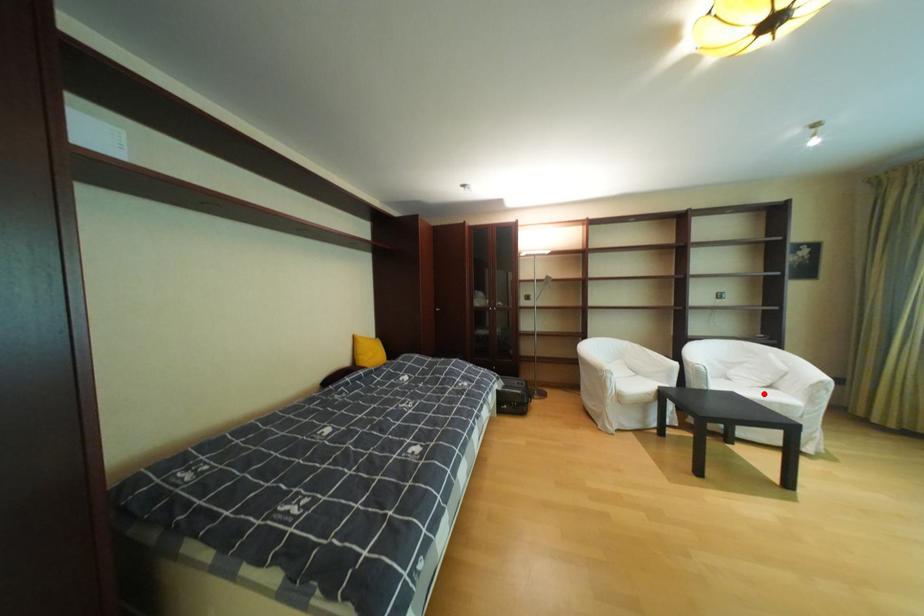
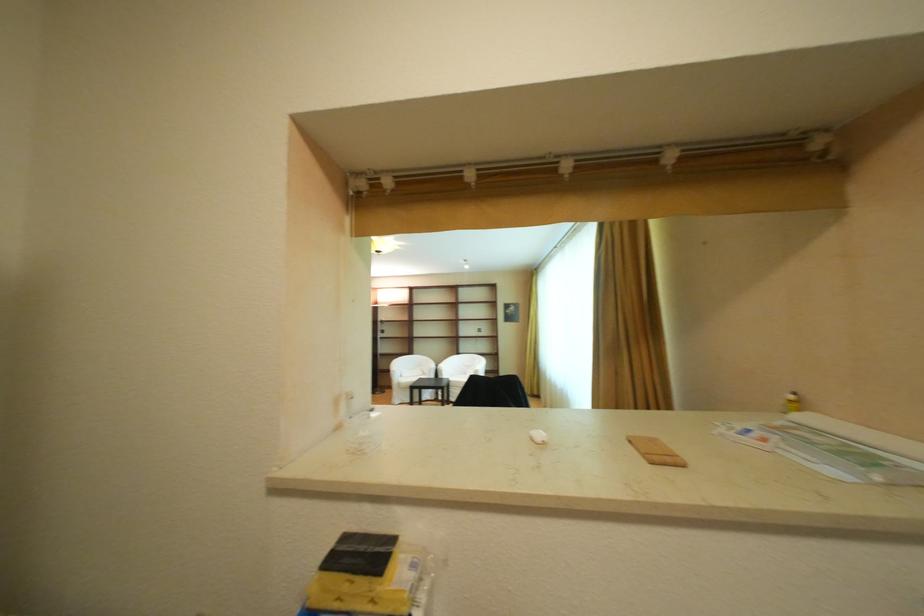
Question: I am providing you with two images of the same scene from different viewpoints. A red point is marked on the first image. Can you still see the location of the red point in image 2?

Choices:
 (A) Yes
 (B) No

Answer: (B)